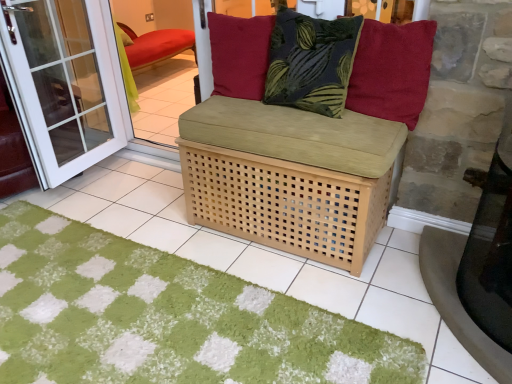
Identify the location of vacant space in front of natural wood basket at center. The height and width of the screenshot is (384, 512). (327, 283).